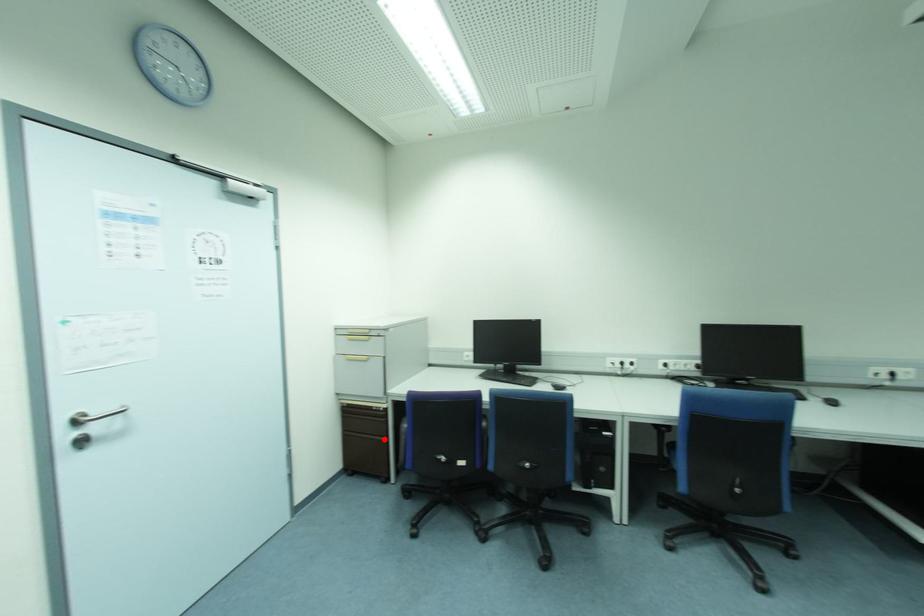
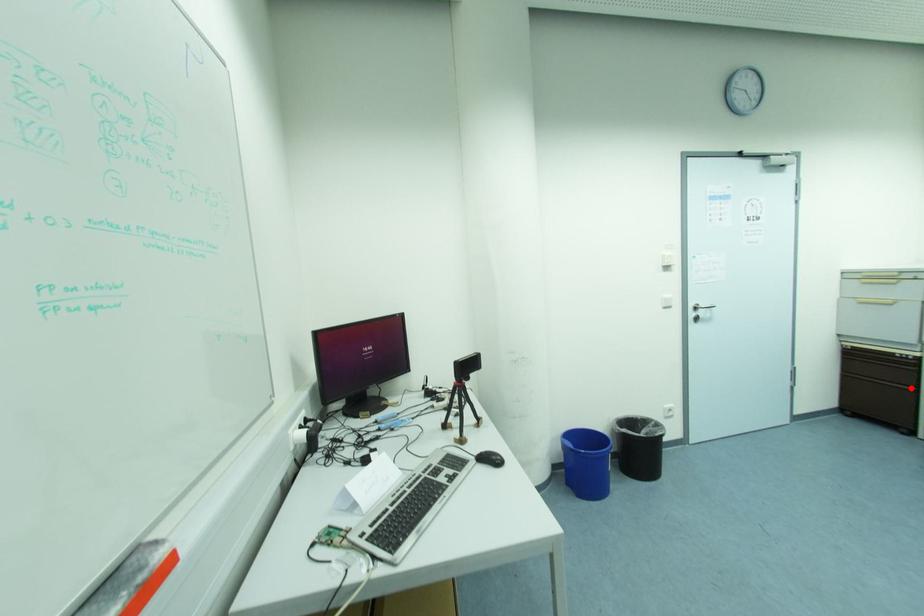
I am providing you with two images of the same scene from different viewpoints. A red point is marked on the first image and another point is marked on the second image. Do the highlighted points in image1 and image2 indicate the same real-world spot?

Yes